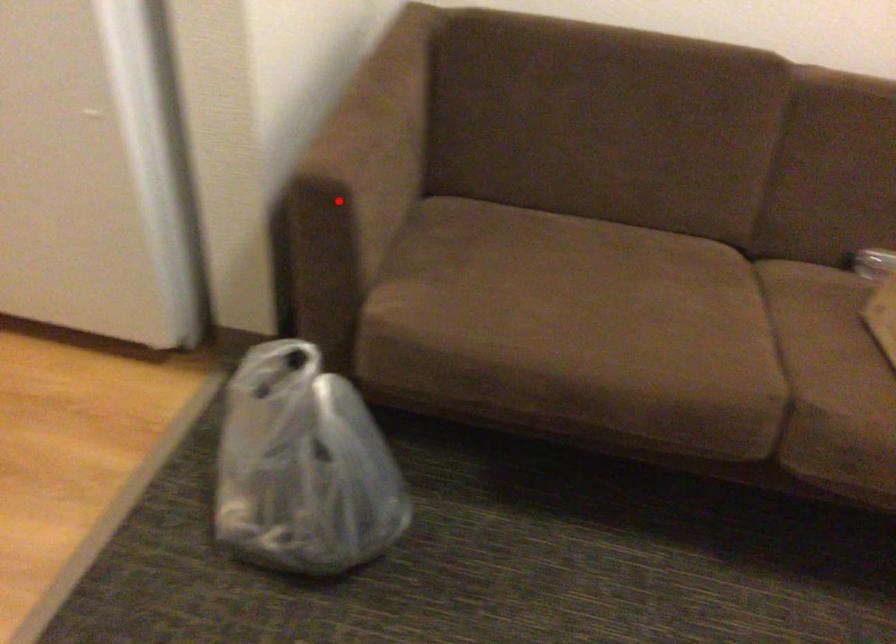
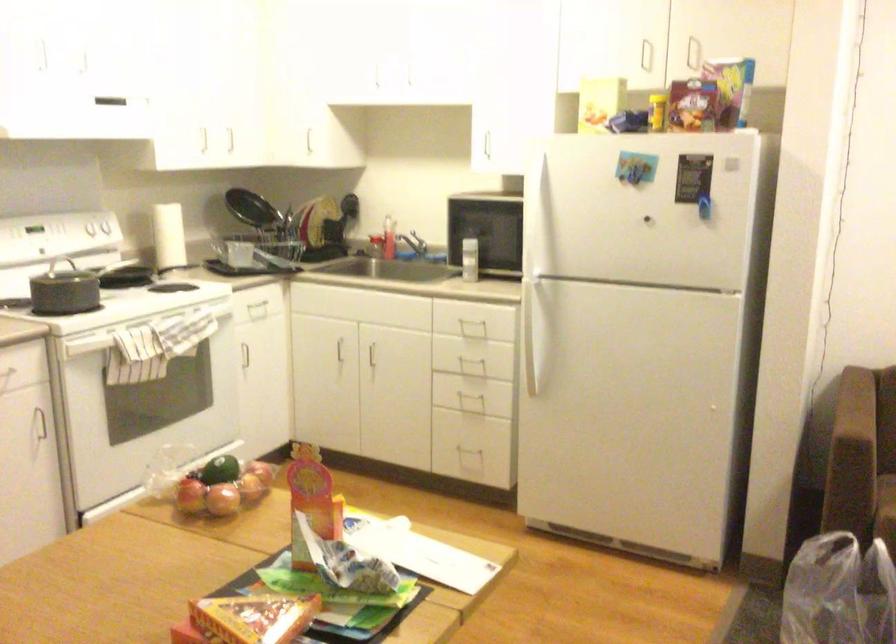
Question: I am providing you with two images of the same scene from different viewpoints. Image1 has a red point marked. In image2, the corresponding 3D location appears at what relative position? Reply with the corresponding letter.

Choices:
 (A) Closer
 (B) Farther

Answer: (B)